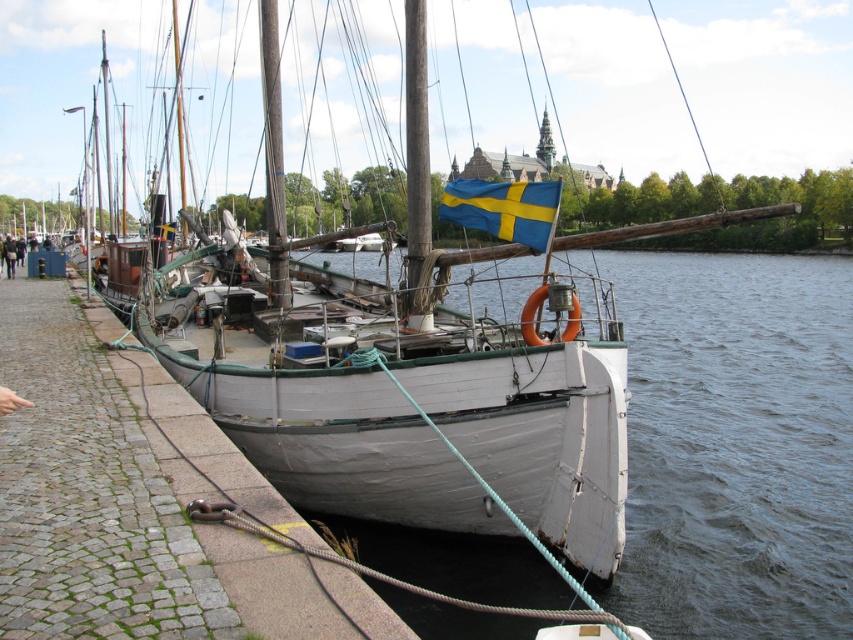
Question: Which point is closer to the camera?

Choices:
 (A) white matte water at lower center
 (B) dark brown leather jacket at lower left

Answer: (A)

Question: Which point is closer to the camera taking this photo?

Choices:
 (A) (4, 253)
 (B) (558, 195)
 (C) (695, 440)

Answer: (B)

Question: Can you confirm if white matte water at lower center is positioned to the right of blue/yellow fabric flag at upper center?

Choices:
 (A) yes
 (B) no

Answer: (A)

Question: Among these objects, which one is farthest from the camera?

Choices:
 (A) gray stone dock at lower left
 (B) white matte water at lower center
 (C) blue/yellow fabric flag at upper center
 (D) dark brown leather jacket at lower left

Answer: (D)

Question: Is gray stone dock at lower left wider than blue/yellow fabric flag at upper center?

Choices:
 (A) yes
 (B) no

Answer: (A)

Question: Is white matte water at lower center in front of gray stone dock at lower left?

Choices:
 (A) yes
 (B) no

Answer: (B)